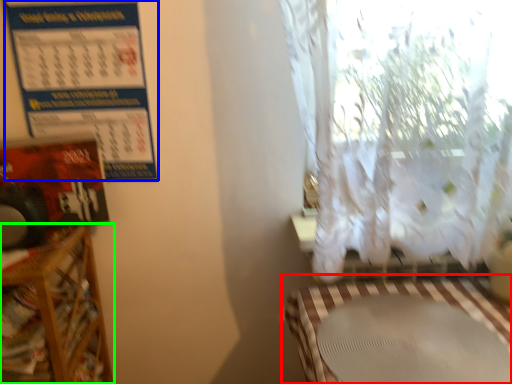
Question: Considering the real-world distances, which object is closest to table (highlighted by a red box)? calendar (highlighted by a blue box) or furniture (highlighted by a green box).

Choices:
 (A) calendar
 (B) furniture

Answer: (B)